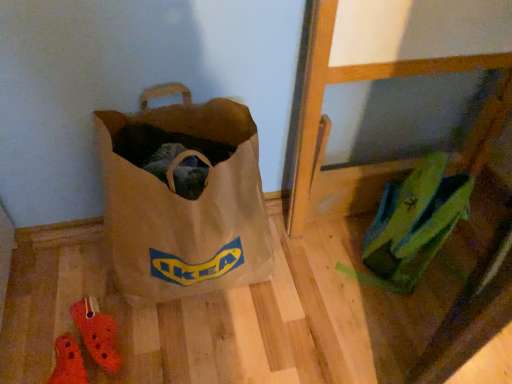
Identify the location of free region on the left part of rubber crocs at lower left, which ranks as the second footwear in top-to-bottom order. Image resolution: width=512 pixels, height=384 pixels. click(x=24, y=351).